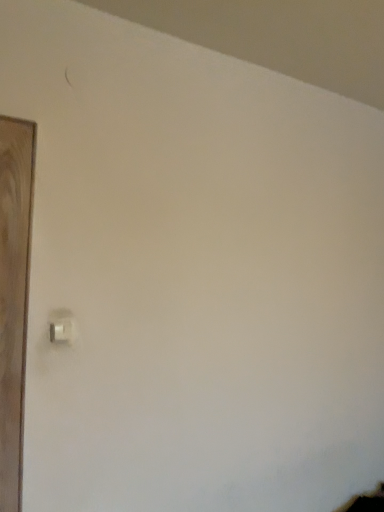
What do you see at coordinates (62, 330) in the screenshot? The height and width of the screenshot is (512, 384). I see `white plastic light switch at lower left` at bounding box center [62, 330].

What is the approximate height of white plastic light switch at lower left?

white plastic light switch at lower left is 6.96 centimeters tall.

The width and height of the screenshot is (384, 512). I want to click on white plastic light switch at lower left, so click(62, 330).

Locate an element on the screen. This screenshot has width=384, height=512. white plastic light switch at lower left is located at coordinates (62, 330).